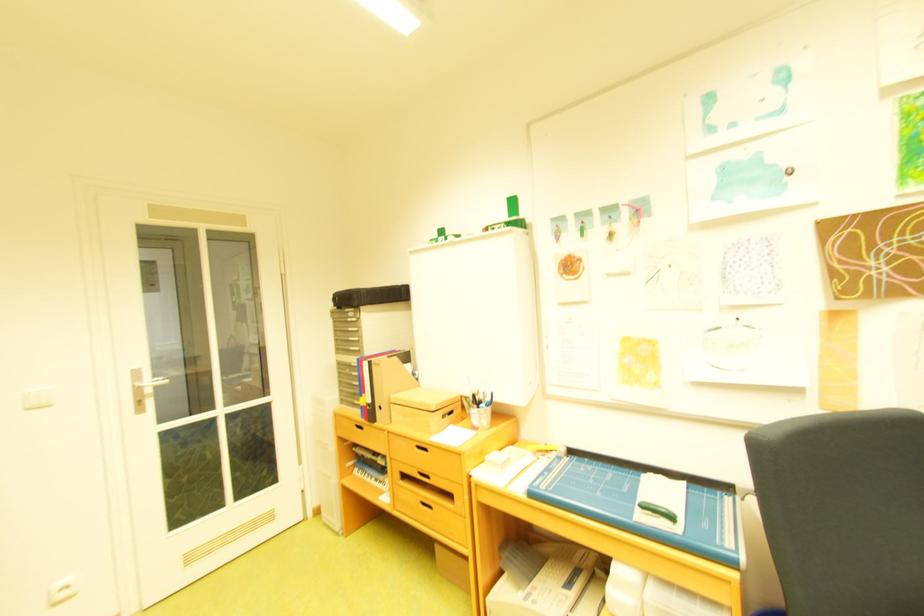
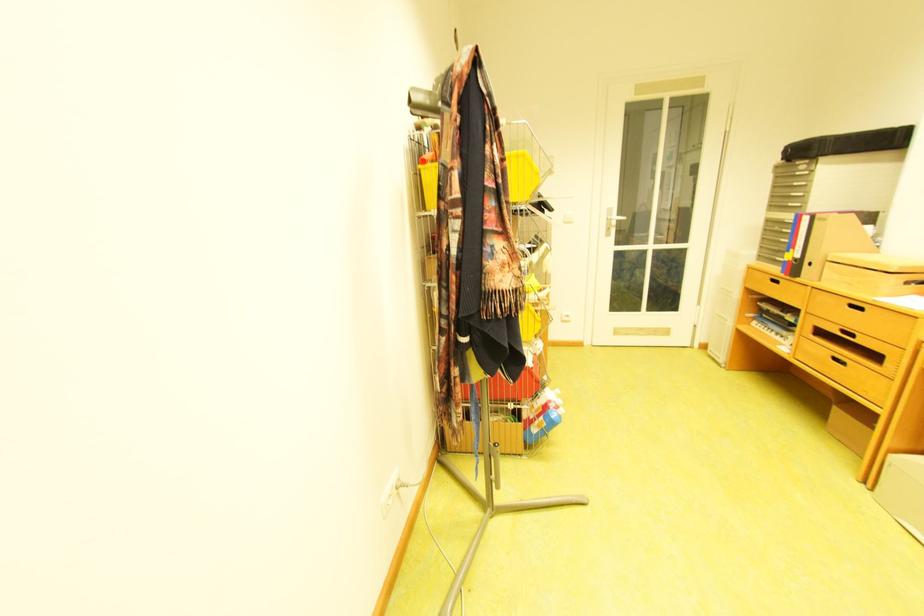
Locate, in the second image, the point that corresponds to pixel 381 402 in the first image.

(809, 257)